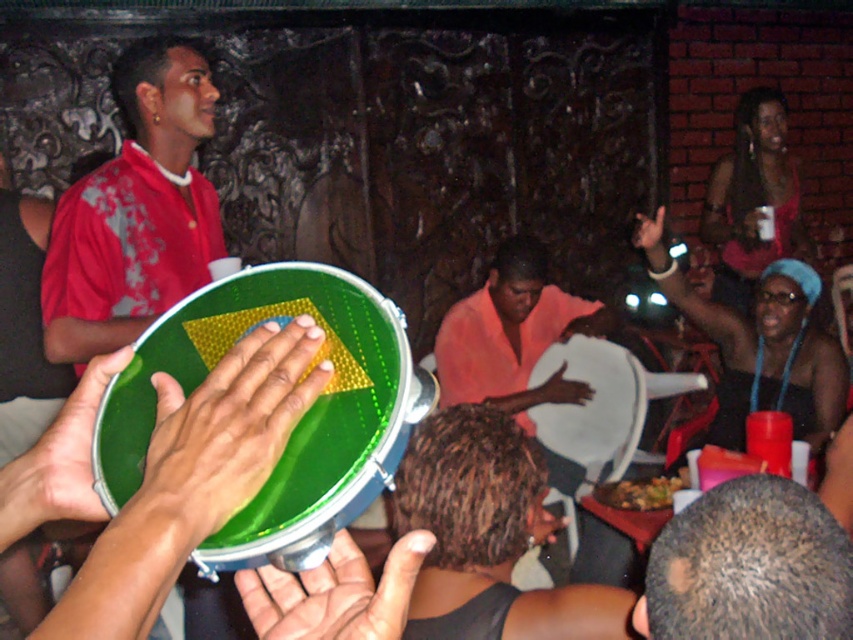
Which is behind, point (160, 83) or point (634, 236)?

Point (634, 236)

Which is more to the right, red floral shirt at upper left or smooth skin hand at upper right?

Positioned to the right is smooth skin hand at upper right.

Is point (132, 189) farther from camera compared to point (653, 218)?

That is False.

The image size is (853, 640). I want to click on red floral shirt at upper left, so click(x=135, y=211).

Find the location of `red floral shirt at upper left`. red floral shirt at upper left is located at coordinates (135, 211).

Is point (74, 253) farther from viewer compared to point (160, 432)?

Yes, point (74, 253) is behind point (160, 432).

This screenshot has width=853, height=640. Describe the element at coordinates (135, 211) in the screenshot. I see `red floral shirt at upper left` at that location.

The width and height of the screenshot is (853, 640). Find the location of `red floral shirt at upper left`. red floral shirt at upper left is located at coordinates (135, 211).

Who is more forward, (796, 570) or (260, 381)?

Point (260, 381) is more forward.

Is the position of dark brown fur at center more distant than that of green rubber drum at center?

Yes, dark brown fur at center is further from the viewer.

Locate an element on the screen. This screenshot has width=853, height=640. dark brown fur at center is located at coordinates (749, 566).

Locate an element on the screen. dark brown fur at center is located at coordinates (749, 566).